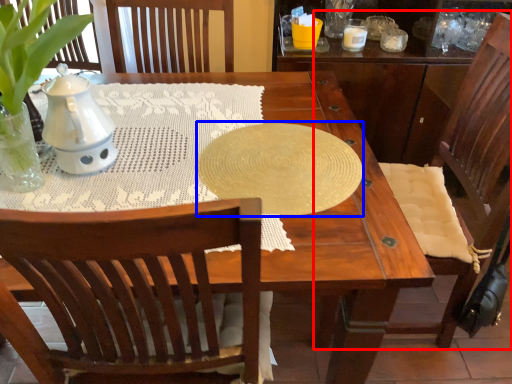
Question: Which point is further to the camera, chair (highlighted by a red box) or oval (highlighted by a blue box)?

Choices:
 (A) chair
 (B) oval

Answer: (B)